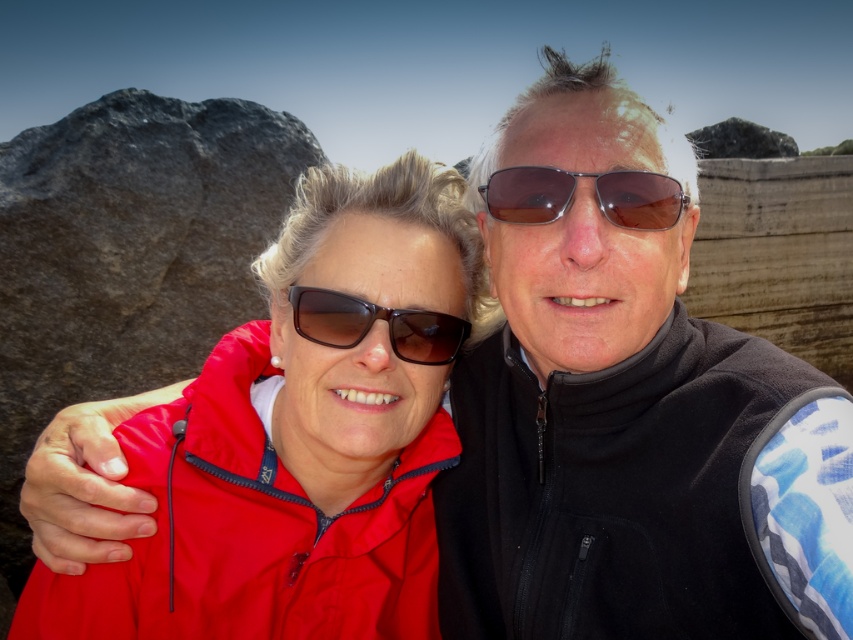
You are taking a photo of two friends standing at the point marked by point (430, 300) and point (368, 316). Which point is closer to the camera?

Point (430, 300) is further to the camera than point (368, 316), so the closer point to the camera is point (368, 316).

You are a photographer trying to capture a clear shot of both the black fleece jacket at center and the matte black sunglasses at center in the image. Since both are at the center, which object should you focus on first to ensure it is in the frame and properly framed?

The black fleece jacket at center is taller than the matte black sunglasses at center, so you should focus on the black fleece jacket at center first to ensure it is fully captured in the frame.